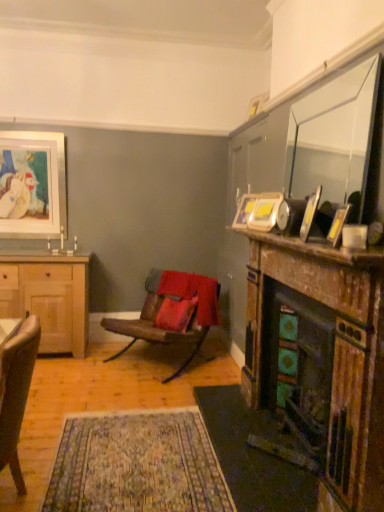
Question: From the image's perspective, would you say clear glass mirror at upper right is positioned over wooden mantelpiece at right?

Choices:
 (A) yes
 (B) no

Answer: (A)

Question: Considering the relative sizes of clear glass mirror at upper right and wooden mantelpiece at right in the image provided, is clear glass mirror at upper right taller than wooden mantelpiece at right?

Choices:
 (A) yes
 (B) no

Answer: (A)

Question: From a real-world perspective, is clear glass mirror at upper right beneath wooden mantelpiece at right?

Choices:
 (A) no
 (B) yes

Answer: (A)

Question: Is clear glass mirror at upper right positioned with its back to wooden mantelpiece at right?

Choices:
 (A) yes
 (B) no

Answer: (B)

Question: Considering the relative sizes of clear glass mirror at upper right and wooden mantelpiece at right in the image provided, is clear glass mirror at upper right shorter than wooden mantelpiece at right?

Choices:
 (A) no
 (B) yes

Answer: (A)

Question: Does point (185, 342) appear closer or farther from the camera than point (228, 388)?

Choices:
 (A) closer
 (B) farther

Answer: (B)

Question: From a real-world perspective, is leather at center, placed as the first chair when sorted from back to front, physically located above or below dark brown textured rug at lower center?

Choices:
 (A) above
 (B) below

Answer: (A)

Question: From the image's perspective, is leather at center, placed as the first chair when sorted from back to front, located above or below dark brown textured rug at lower center?

Choices:
 (A) above
 (B) below

Answer: (A)

Question: Considering their positions, is leather at center, placed as the first chair when sorted from back to front, located in front of or behind dark brown textured rug at lower center?

Choices:
 (A) behind
 (B) front

Answer: (A)

Question: Considering the positions of light brown wooden cabinet at left and matte gray corded phone at upper right in the image, is light brown wooden cabinet at left wider or thinner than matte gray corded phone at upper right?

Choices:
 (A) wide
 (B) thin

Answer: (A)

Question: Looking at the image, does light brown wooden cabinet at left seem bigger or smaller compared to matte gray corded phone at upper right?

Choices:
 (A) small
 (B) big

Answer: (B)

Question: From the image's perspective, is light brown wooden cabinet at left positioned above or below matte gray corded phone at upper right?

Choices:
 (A) above
 (B) below

Answer: (B)

Question: Is light brown wooden cabinet at left spatially inside matte gray corded phone at upper right, or outside of it?

Choices:
 (A) outside
 (B) inside

Answer: (A)

Question: Considering the positions of yellow matte picture frame at upper right, acting as the first picture frame starting from the front, and metallic gold picture frame at upper right, acting as the second picture frame starting from the front, in the image, is yellow matte picture frame at upper right, acting as the first picture frame starting from the front, bigger or smaller than metallic gold picture frame at upper right, acting as the second picture frame starting from the front,?

Choices:
 (A) big
 (B) small

Answer: (B)

Question: Considering the positions of yellow matte picture frame at upper right, placed as the 5th picture frame when sorted from left to right, and metallic gold picture frame at upper right, which is counted as the 2th picture frame, starting from the right, in the image, is yellow matte picture frame at upper right, placed as the 5th picture frame when sorted from left to right, taller or shorter than metallic gold picture frame at upper right, which is counted as the 2th picture frame, starting from the right,?

Choices:
 (A) short
 (B) tall

Answer: (A)